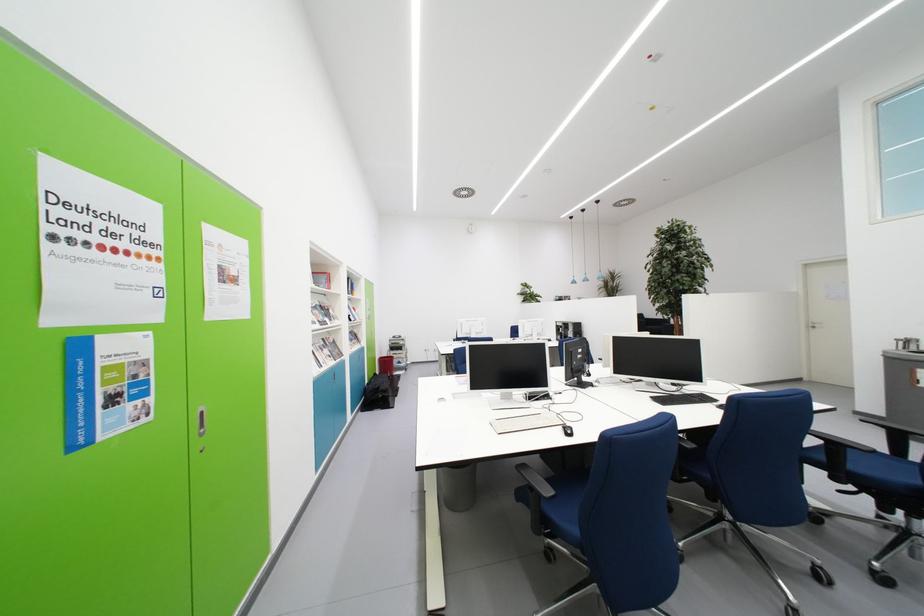
You are a GUI agent. You are given a task and a screenshot of the screen. Output one action in this format:
    pyautogui.click(x=<x>, y=<y>)
    Task: Click on the blue chair sitting surface
    Image resolution: width=924 pixels, height=616 pixels.
    Given the screenshot: What is the action you would take?
    pyautogui.click(x=881, y=466)